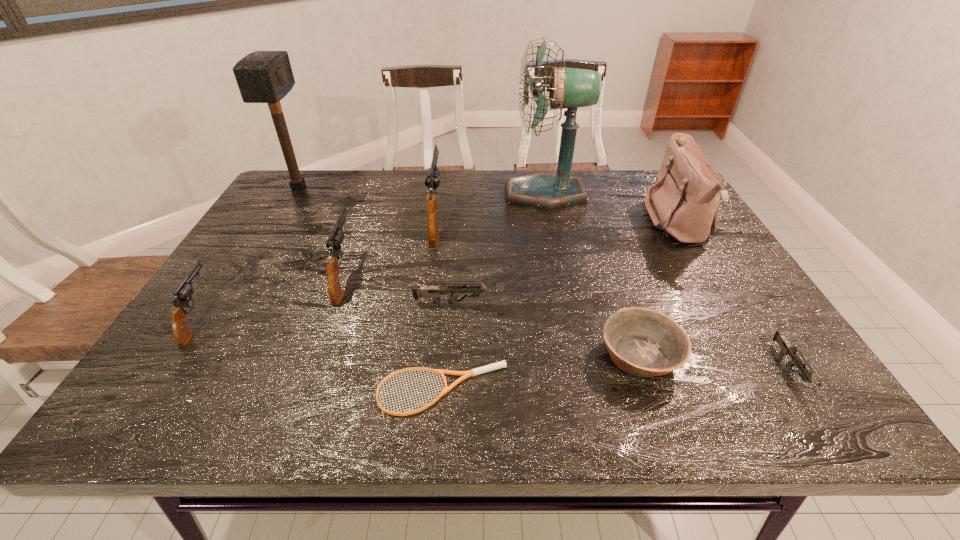
At what (x,y) coordinates should I click in order to perform the action: click on free space located 0.360m on the front pocket of the shoulder bag. Please return your answer as a coordinate pair (x, y). Looking at the image, I should click on (522, 224).

Locate an element on the screen. blank space located on the front pocket of the shoulder bag is located at coordinates (512, 224).

Find the location of a particular element. This screenshot has width=960, height=540. vacant space located on the front pocket of the shoulder bag is located at coordinates (628, 224).

Where is `vacant space positioned 0.150m along the barrel of the farthest gun`? The image size is (960, 540). vacant space positioned 0.150m along the barrel of the farthest gun is located at coordinates (443, 172).

Image resolution: width=960 pixels, height=540 pixels. What are the coordinates of `blank area located 0.160m along the barrel of the farthest gun` in the screenshot? It's located at (443, 171).

Locate an element on the screen. The image size is (960, 540). vacant position located 0.090m along the barrel of the farthest gun is located at coordinates [x=442, y=181].

Locate an element on the screen. The width and height of the screenshot is (960, 540). vacant space positioned along the barrel of the third object from left to right is located at coordinates (378, 181).

Locate an element on the screen. vacant space located 0.090m along the barrel of the third object from left to right is located at coordinates (361, 228).

The width and height of the screenshot is (960, 540). Find the location of `blank space located along the barrel of the third object from left to right`. blank space located along the barrel of the third object from left to right is located at coordinates (372, 197).

The height and width of the screenshot is (540, 960). In order to click on blank space located 0.080m along the barrel of the third shortest gun in this screenshot , I will do coord(230,272).